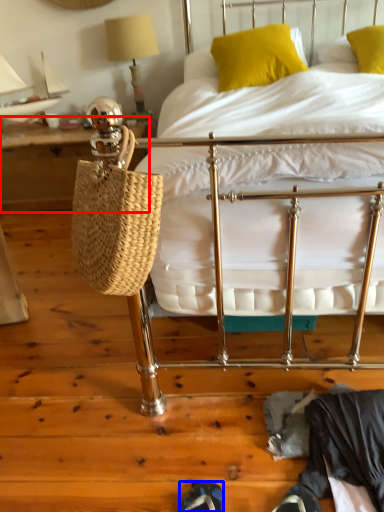
Question: Which point is further to the camera, table (highlighted by a red box) or shoe (highlighted by a blue box)?

Choices:
 (A) table
 (B) shoe

Answer: (A)